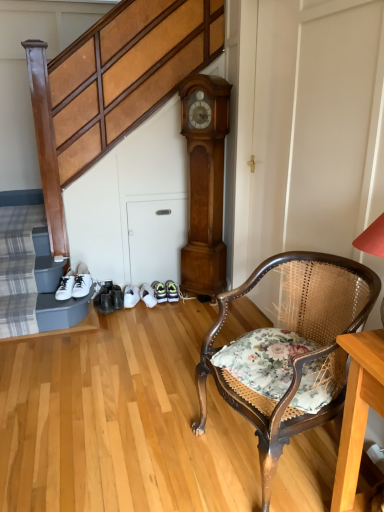
You are a GUI agent. You are given a task and a screenshot of the screen. Output one action in this format:
    pyautogui.click(x=<x>, y=<y>)
    Task: Click on the vacant region to the left of floral fabric chair at lower right
    This screenshot has width=384, height=512.
    Given the screenshot: What is the action you would take?
    pyautogui.click(x=154, y=446)